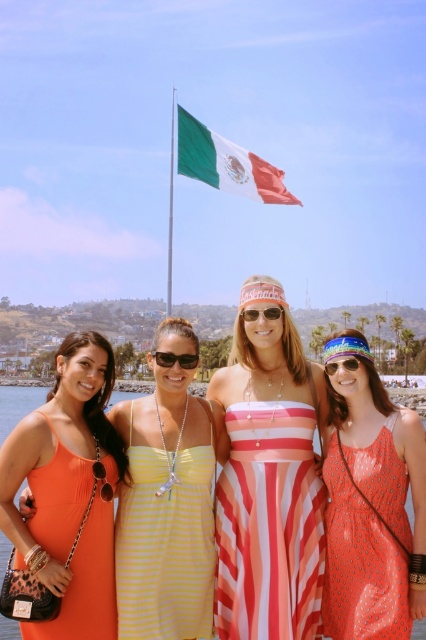
Question: Can you confirm if green and white striped fabric at upper center is positioned to the right of green metallic flag pole at upper center?

Choices:
 (A) no
 (B) yes

Answer: (B)

Question: Among these objects, which one is nearest to the camera?

Choices:
 (A) matte orange dress at lower left
 (B) matte plastic goggles at center
 (C) orange ribbed dress at lower left

Answer: (C)

Question: Which of the following is the farthest from the observer?

Choices:
 (A) clear plastic sunglasses at center
 (B) matte orange dress at lower left
 (C) sunglasses at center

Answer: (C)

Question: From the image, what is the correct spatial relationship of orange dotted fabric dress at lower right in relation to matte plastic goggles at center?

Choices:
 (A) below
 (B) above

Answer: (A)

Question: Considering the real-world distances, which object is farthest from the green metallic flag pole at upper center?

Choices:
 (A) matte plastic goggles at center
 (B) matte orange dress at lower left
 (C) yellow striped dress at center
 (D) orange fabric dress at lower left

Answer: (A)

Question: Can you confirm if orange fabric dress at lower left is thinner than sunglasses at center?

Choices:
 (A) no
 (B) yes

Answer: (A)